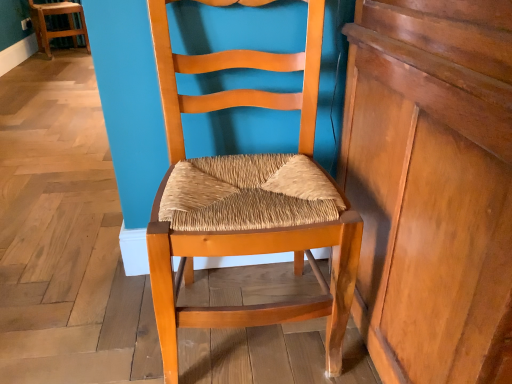
Question: Is wooden woven seat at center, which appears as the 2th chair when viewed from the back, turned away from shiny brown wood dresser at right?

Choices:
 (A) yes
 (B) no

Answer: (B)

Question: Is wooden woven seat at center, the 1th chair positioned from the right, wider than shiny brown wood dresser at right?

Choices:
 (A) no
 (B) yes

Answer: (A)

Question: Can you confirm if wooden woven seat at center, the 2th chair from the left, is taller than shiny brown wood dresser at right?

Choices:
 (A) no
 (B) yes

Answer: (A)

Question: Can you confirm if wooden woven seat at center, which appears as the 2th chair when viewed from the back, is positioned to the right of shiny brown wood dresser at right?

Choices:
 (A) no
 (B) yes

Answer: (A)

Question: From the image's perspective, is wooden woven seat at center, marked as the first chair in a front-to-back arrangement, above shiny brown wood dresser at right?

Choices:
 (A) yes
 (B) no

Answer: (A)

Question: From a real-world perspective, relative to wooden woven seat at center, marked as the first chair in a front-to-back arrangement, is wooden chair at upper left, the 2th chair positioned from the front, vertically above or below?

Choices:
 (A) above
 (B) below

Answer: (B)

Question: In the image, is wooden chair at upper left, which ranks as the second chair in bottom-to-top order, positioned in front of or behind wooden woven seat at center, marked as the first chair in a front-to-back arrangement?

Choices:
 (A) front
 (B) behind

Answer: (B)

Question: Considering the positions of wooden chair at upper left, which ranks as the second chair in bottom-to-top order, and wooden woven seat at center, which is counted as the second chair, starting from the top, in the image, is wooden chair at upper left, which ranks as the second chair in bottom-to-top order, wider or thinner than wooden woven seat at center, which is counted as the second chair, starting from the top,?

Choices:
 (A) thin
 (B) wide

Answer: (B)

Question: Is wooden chair at upper left, which is the first chair from top to bottom, bigger or smaller than wooden woven seat at center, which appears as the 2th chair when viewed from the back?

Choices:
 (A) small
 (B) big

Answer: (A)

Question: From the image's perspective, is wooden woven seat at center, marked as the first chair in a front-to-back arrangement, above or below shiny brown wood dresser at right?

Choices:
 (A) above
 (B) below

Answer: (A)

Question: In terms of width, does wooden woven seat at center, positioned as the first chair in bottom-to-top order, look wider or thinner when compared to shiny brown wood dresser at right?

Choices:
 (A) thin
 (B) wide

Answer: (A)

Question: From a real-world perspective, is wooden woven seat at center, the 2th chair from the left, positioned above or below shiny brown wood dresser at right?

Choices:
 (A) above
 (B) below

Answer: (B)

Question: Looking at the image, does wooden woven seat at center, which is counted as the second chair, starting from the top, seem bigger or smaller compared to shiny brown wood dresser at right?

Choices:
 (A) big
 (B) small

Answer: (B)

Question: Considering the positions of shiny brown wood dresser at right and wooden woven seat at center, the 2th chair from the left, in the image, is shiny brown wood dresser at right taller or shorter than wooden woven seat at center, the 2th chair from the left,?

Choices:
 (A) tall
 (B) short

Answer: (A)

Question: In the image, is shiny brown wood dresser at right positioned in front of or behind wooden woven seat at center, the 2th chair from the left?

Choices:
 (A) behind
 (B) front

Answer: (B)